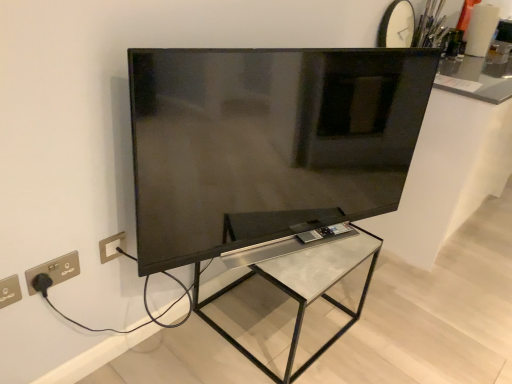
Question: Considering the relative sizes of metallic glass table at center and matte black tv at center in the image provided, is metallic glass table at center taller than matte black tv at center?

Choices:
 (A) yes
 (B) no

Answer: (B)

Question: Is metallic glass table at center positioned beyond the bounds of matte black tv at center?

Choices:
 (A) no
 (B) yes

Answer: (B)

Question: From the image's perspective, is metallic glass table at center below matte black tv at center?

Choices:
 (A) no
 (B) yes

Answer: (B)

Question: From a real-world perspective, does metallic glass table at center sit lower than matte black tv at center?

Choices:
 (A) yes
 (B) no

Answer: (A)

Question: Would you consider metallic glass table at center to be distant from matte black tv at center?

Choices:
 (A) no
 (B) yes

Answer: (A)

Question: Does metallic glass table at center appear on the right side of matte black tv at center?

Choices:
 (A) no
 (B) yes

Answer: (A)

Question: Does white glossy countertop at upper right appear on the right side of gold metallic socket at lower left?

Choices:
 (A) yes
 (B) no

Answer: (A)

Question: Does white glossy countertop at upper right contain gold metallic socket at lower left?

Choices:
 (A) no
 (B) yes

Answer: (A)

Question: Is white glossy countertop at upper right far away from gold metallic socket at lower left?

Choices:
 (A) no
 (B) yes

Answer: (B)

Question: From a real-world perspective, does white glossy countertop at upper right sit lower than gold metallic socket at lower left?

Choices:
 (A) no
 (B) yes

Answer: (B)

Question: From the image's perspective, is white glossy countertop at upper right under gold metallic socket at lower left?

Choices:
 (A) no
 (B) yes

Answer: (A)

Question: Can you confirm if white glossy countertop at upper right is taller than gold metallic socket at lower left?

Choices:
 (A) yes
 (B) no

Answer: (A)

Question: Considering the relative positions of white glossy countertop at upper right and metallic glass table at center in the image provided, is white glossy countertop at upper right to the right of metallic glass table at center from the viewer's perspective?

Choices:
 (A) no
 (B) yes

Answer: (B)